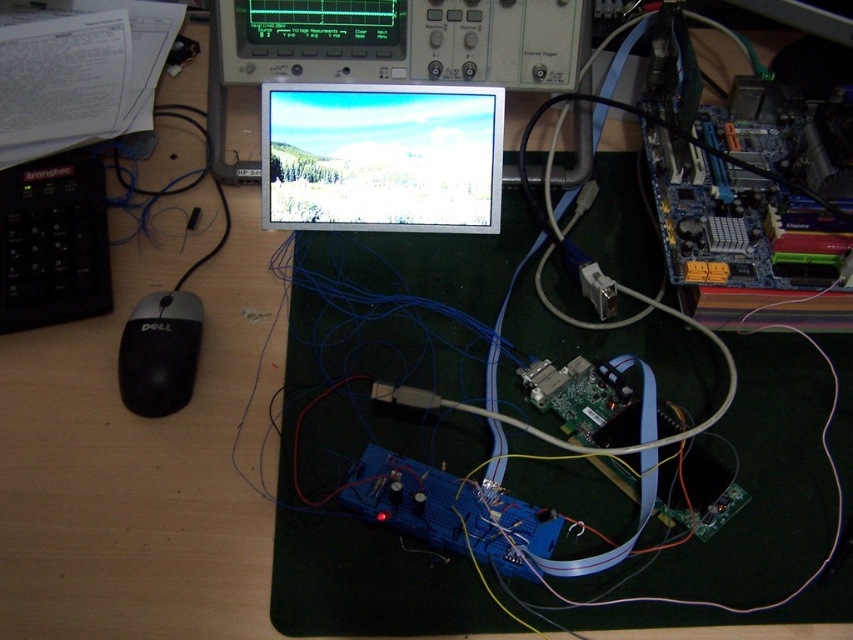
Question: Is the position of matte black screen at center less distant than that of black matte mouse at lower left?

Choices:
 (A) yes
 (B) no

Answer: (B)

Question: Does matte black screen at center have a greater width compared to black matte mouse at lower left?

Choices:
 (A) no
 (B) yes

Answer: (B)

Question: Which of the following is the closest to the observer?

Choices:
 (A) (184, 326)
 (B) (409, 200)

Answer: (A)

Question: Does matte black screen at center come in front of black matte mouse at lower left?

Choices:
 (A) no
 (B) yes

Answer: (A)